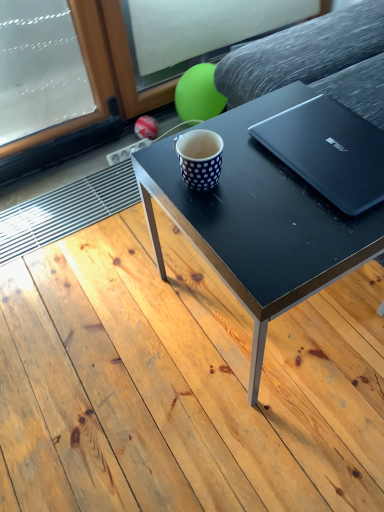
You are a GUI agent. You are given a task and a screenshot of the screen. Output one action in this format:
    pyautogui.click(x=<x>, y=<y>)
    Task: Click on the free space in front of black matte laptop at upper right
    The width and height of the screenshot is (384, 512).
    Given the screenshot: What is the action you would take?
    pyautogui.click(x=306, y=241)